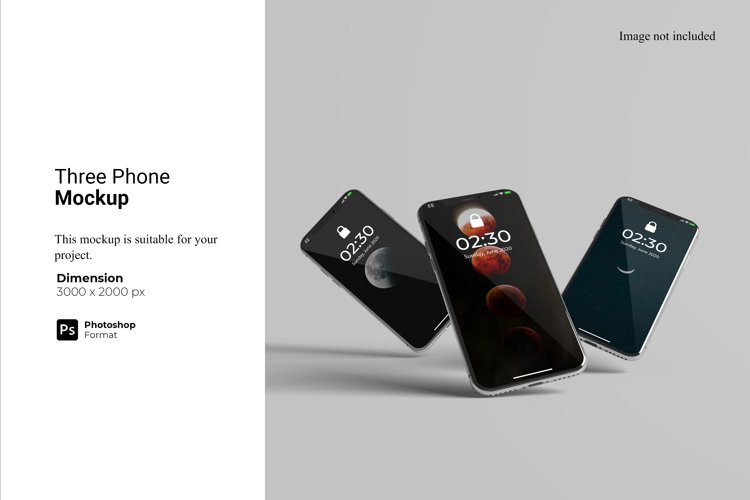
Image resolution: width=750 pixels, height=500 pixels. What are the coordinates of `phone` in the screenshot? It's located at (612, 265).